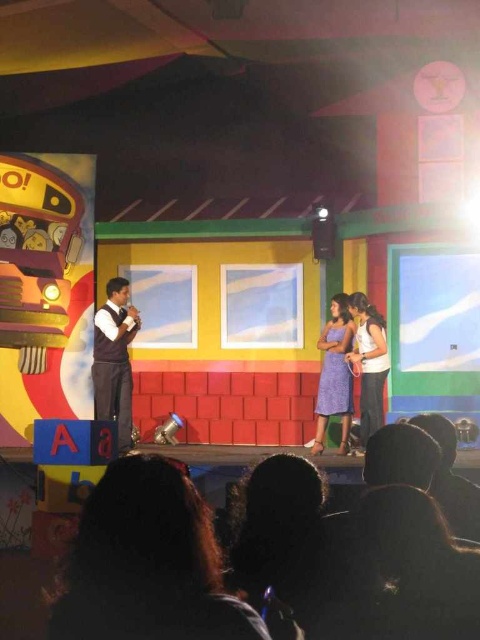
Question: In this image, where is dark brown vest at center located relative to lavender fabric dress at center?

Choices:
 (A) above
 (B) below

Answer: (A)

Question: Which object appears farthest from the camera in this image?

Choices:
 (A) dark brown vest at center
 (B) white matte shirt at right
 (C) lavender fabric dress at center

Answer: (C)

Question: Is dark brown hair at lower center in front of dark brown vest at center?

Choices:
 (A) no
 (B) yes

Answer: (B)

Question: Among these points, which one is farthest from the camera?

Choices:
 (A) (93, 390)
 (B) (333, 378)
 (C) (360, 422)

Answer: (A)

Question: Which point is closer to the camera?

Choices:
 (A) (324, 416)
 (B) (356, 340)
 (C) (94, 365)
 (D) (155, 513)

Answer: (D)

Question: Does dark brown vest at center have a greater width compared to lavender fabric dress at center?

Choices:
 (A) no
 (B) yes

Answer: (B)